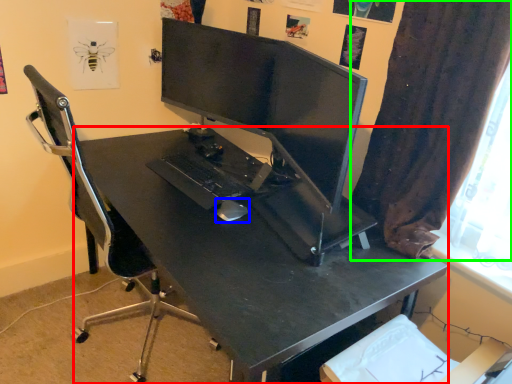
Question: Which is farther away from desk (highlighted by a red box)? mouse (highlighted by a blue box) or curtain (highlighted by a green box)?

Choices:
 (A) mouse
 (B) curtain

Answer: (B)